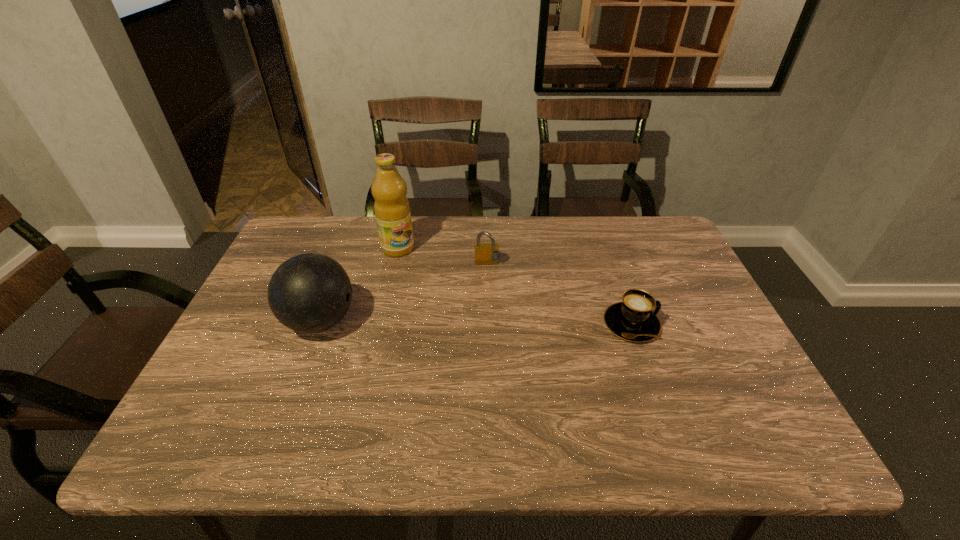
Image resolution: width=960 pixels, height=540 pixels. In the image, there is a desktop. Identify the location of vacant space at the far edge. (550, 219).

You are a GUI agent. You are given a task and a screenshot of the screen. Output one action in this format:
    pyautogui.click(x=<x>, y=<y>)
    Task: Click on the free space at the near edge of the desktop
    This screenshot has height=540, width=960.
    Given the screenshot: What is the action you would take?
    pyautogui.click(x=642, y=392)

Image resolution: width=960 pixels, height=540 pixels. What are the coordinates of `vacant space at the left edge of the desktop` in the screenshot? It's located at (264, 276).

In the image, there is a desktop. In order to click on vacant area at the right edge in this screenshot , I will do `click(672, 351)`.

In the image, there is a desktop. Where is `vacant space at the far left corner`? This screenshot has width=960, height=540. vacant space at the far left corner is located at coordinates (x=292, y=240).

Where is `free space at the near left corner of the desktop`? This screenshot has width=960, height=540. free space at the near left corner of the desktop is located at coordinates (213, 401).

This screenshot has height=540, width=960. Find the location of `blank space at the far right corner of the desktop`. blank space at the far right corner of the desktop is located at coordinates (637, 219).

Find the location of a particular element. empty space between the rightmost object and the third shortest object is located at coordinates (476, 322).

I want to click on empty location between the padlock and the olive oil, so click(443, 256).

The height and width of the screenshot is (540, 960). Identify the location of free space between the bowling ball and the rightmost object. (476, 322).